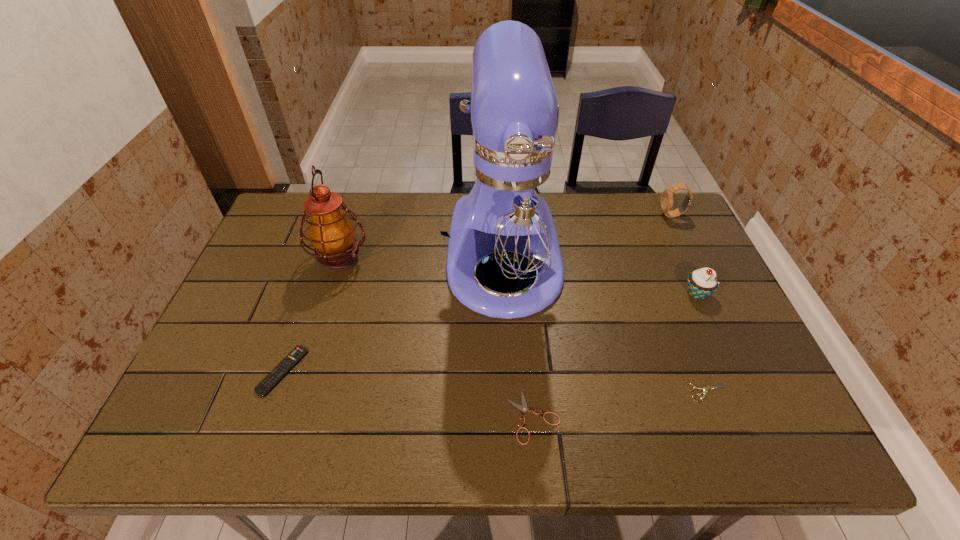
Locate which object ranks fourth in proximity to the sixth shortest object. Please provide its 2D coordinates. Your answer should be formatted as a tuple, i.e. [(x, y)], where the tuple contains the x and y coordinates of a point satisfying the conditions above.

[(706, 388)]

This screenshot has width=960, height=540. Identify the location of blank space that satisfies the following two spatial constraints: 1. at the mixing area of the mixer; 2. on the left side of the left shears. (513, 417).

You are a GUI agent. You are given a task and a screenshot of the screen. Output one action in this format:
    pyautogui.click(x=<x>, y=<y>)
    Task: Click on the free space that satisfies the following two spatial constraints: 1. at the mixing area of the cupcake; 2. on the right side of the mixer
    Image resolution: width=960 pixels, height=540 pixels.
    Given the screenshot: What is the action you would take?
    pyautogui.click(x=506, y=294)